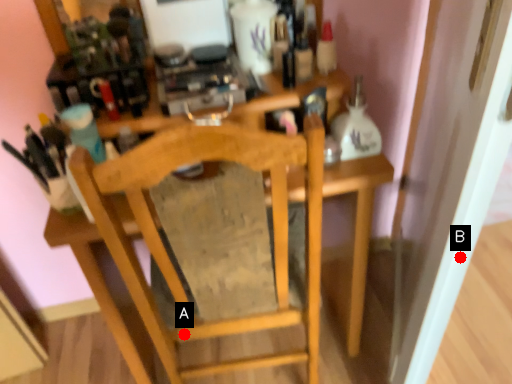
Question: Two points are circled on the image, labeled by A and B beside each circle. Which point is closer to the camera?

Choices:
 (A) A is closer
 (B) B is closer

Answer: (B)